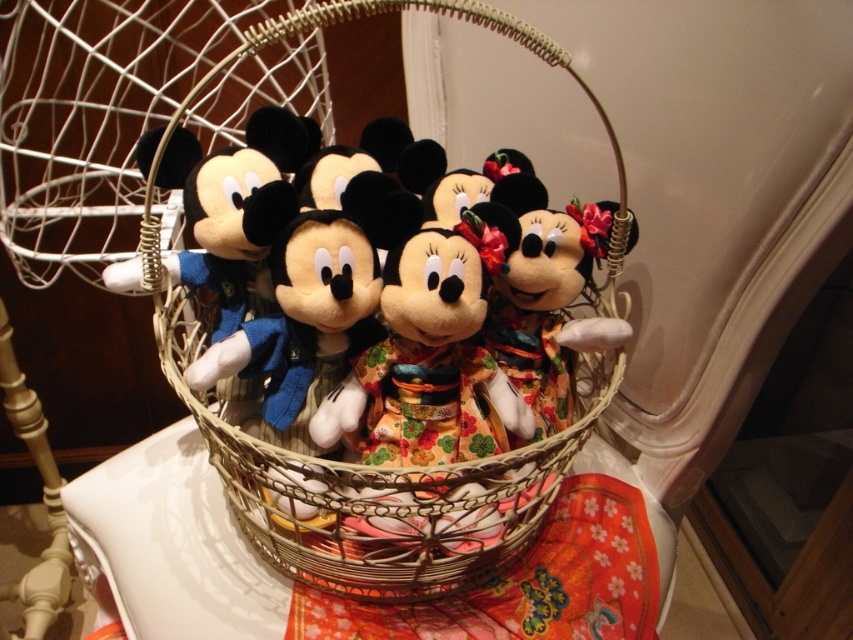
You are arranging a tea party for guests and need to place a centerpiece on the white glossy table at center. However, the woven straw basket at center is currently occupying the space. Can you move the basket to the left side of the table to make room?

The woven straw basket at center is to the right of the white glossy table at center, so you can move it to the left side of the table to free up space for the centerpiece.

You have a small plate that is 15 cm in diameter. You want to place it on the white glossy table at center without it hanging over the edge. Can you also place the woven straw basket at center on the same table without overlapping them?

The woven straw basket at center is wider than the white glossy table at center, so placing it on the table would cause it to hang over the edges. Therefore, you cannot place both the plate and the basket on the table without overlapping or overhanging.